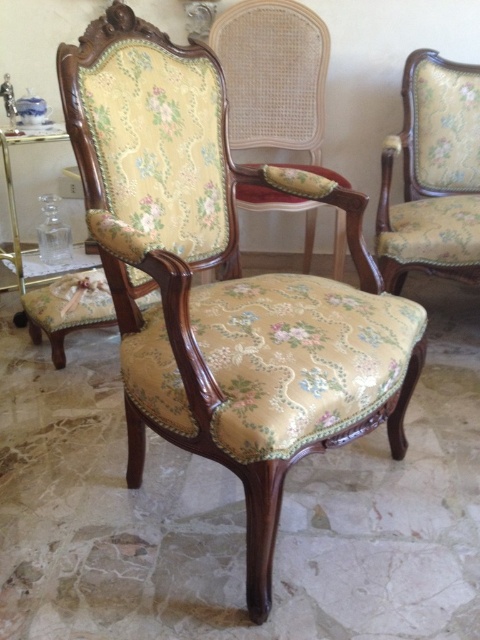
Between floral fabric stool at center and matte glass lampshade at upper center, which one appears on the left side from the viewer's perspective?

floral fabric stool at center is more to the left.

Is floral fabric stool at center positioned at the back of matte glass lampshade at upper center?

No.

I want to click on floral fabric stool at center, so pyautogui.click(x=68, y=308).

Which is above, floral fabric armchair at center or floral fabric stool at center?

floral fabric armchair at center

Between point (276, 48) and point (147, 296), which one is positioned in front?

Point (147, 296) is in front.

Which is behind, point (222, 61) or point (101, 296)?

The point (222, 61) is more distant.

Where is `floral fabric armchair at center`? Image resolution: width=480 pixels, height=640 pixels. floral fabric armchair at center is located at coordinates (275, 76).

Can you confirm if floral fabric armchair at center is taller than matte glass lampshade at upper center?

Correct, floral fabric armchair at center is much taller as matte glass lampshade at upper center.

Which is more to the left, floral fabric armchair at center or matte glass lampshade at upper center?

matte glass lampshade at upper center

Does point (252, 196) come farther from viewer compared to point (207, 17)?

No, it is in front of (207, 17).

Identify the location of floral fabric armchair at center. This screenshot has height=640, width=480. (275, 76).